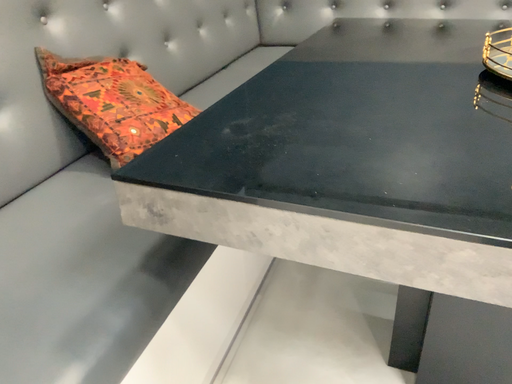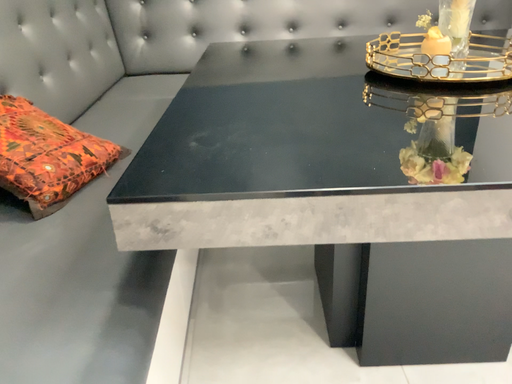
Question: How did the camera likely rotate when shooting the video?

Choices:
 (A) rotated right
 (B) rotated left

Answer: (A)